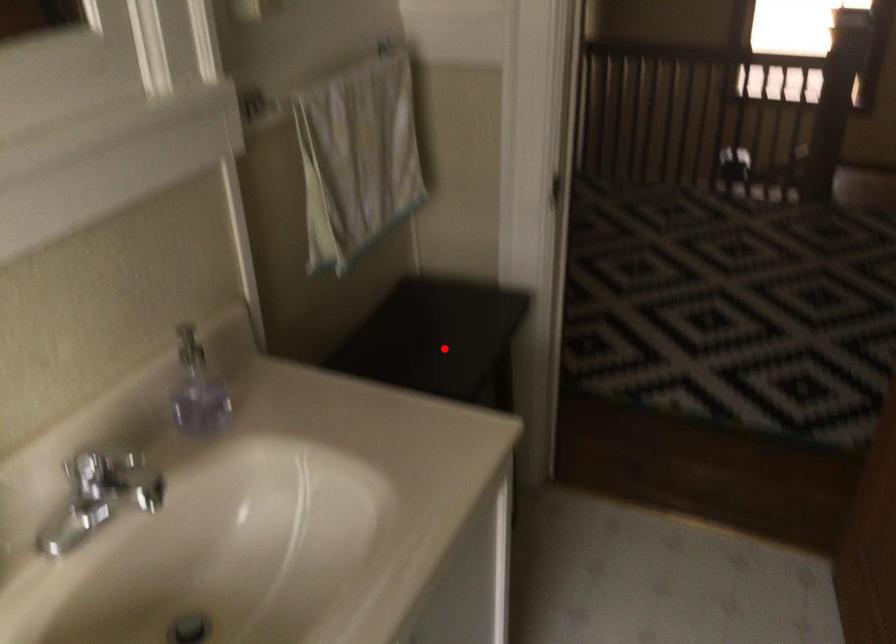
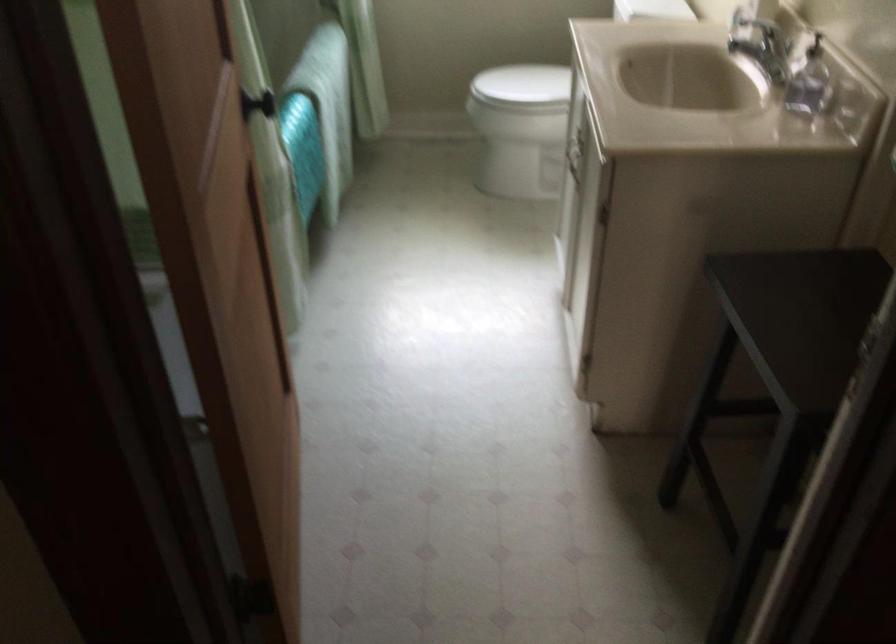
Where in the second image is the point corresponding to the highlighted location from the first image?

(798, 317)